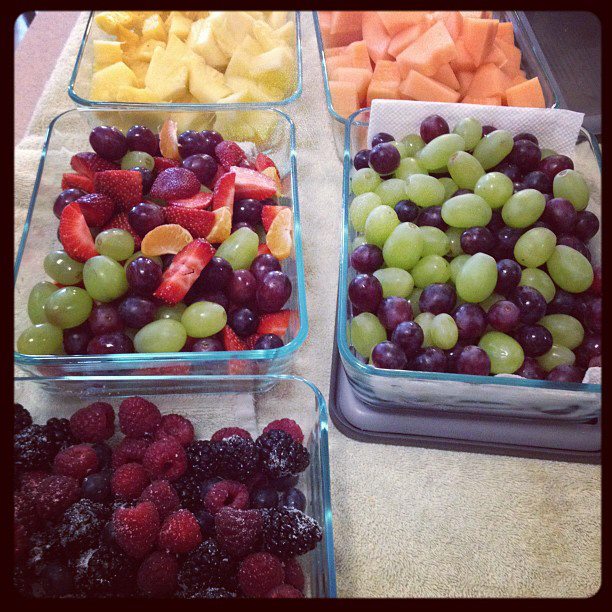
Identify the location of glass. (230, 398).